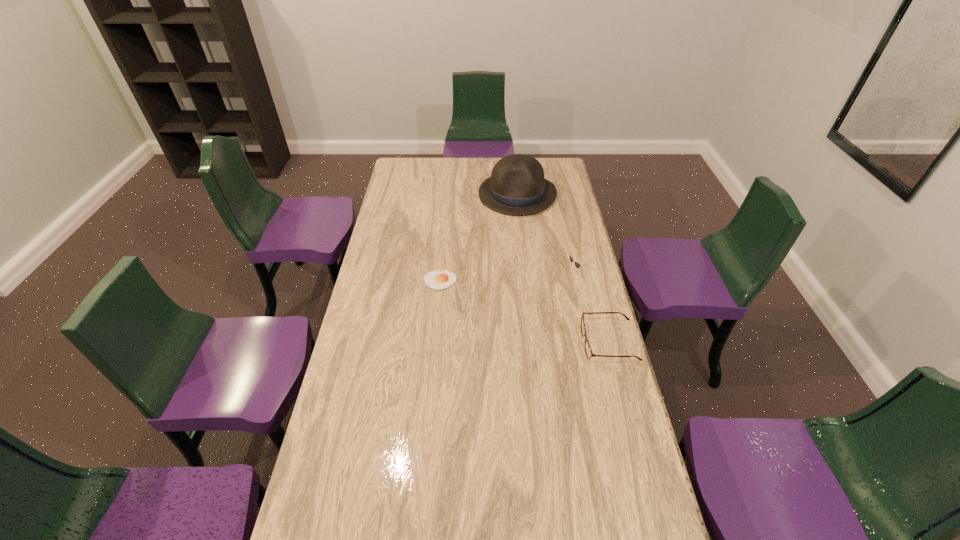
Identify the location of vacant space located on the lenses of the second shortest object. The width and height of the screenshot is (960, 540). (565, 342).

At what (x,y) coordinates should I click in order to perform the action: click on blank space located 0.220m in front of the lenses of the sunglasses. Please return your answer as a coordinate pair (x, y). This screenshot has width=960, height=540. Looking at the image, I should click on (516, 299).

Image resolution: width=960 pixels, height=540 pixels. In order to click on free space located in front of the lenses of the sunglasses in this screenshot , I will do `click(514, 300)`.

Find the location of a particular element. The height and width of the screenshot is (540, 960). free region located 0.100m in front of the lenses of the sunglasses is located at coordinates (543, 288).

This screenshot has height=540, width=960. What are the coordinates of `vacant space situated 0.120m on the front-facing side of the bowler hat` in the screenshot? It's located at (519, 233).

Identify the location of vacant area situated on the front-facing side of the bowler hat. The image size is (960, 540). (520, 269).

At what (x,y) coordinates should I click in order to perform the action: click on blank space located on the front-facing side of the bowler hat. Please return your answer as a coordinate pair (x, y). Looking at the image, I should click on (519, 231).

Locate an element on the screen. This screenshot has height=540, width=960. object that is at the far edge is located at coordinates (517, 186).

Locate an element on the screen. spectacles located in the right edge section of the desktop is located at coordinates (588, 351).

Where is `sunglasses present at the right edge`? The height and width of the screenshot is (540, 960). sunglasses present at the right edge is located at coordinates (577, 265).